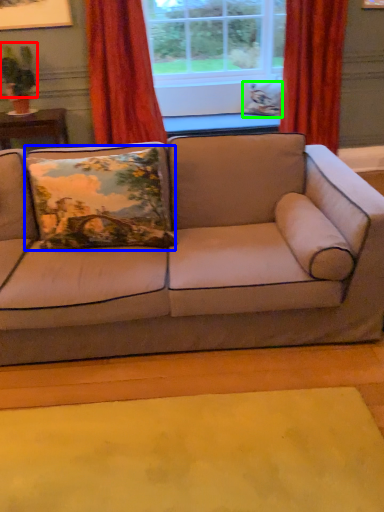
Question: Which is nearer to the plant (highlighted by a red box)? pillow (highlighted by a blue box) or pillow (highlighted by a green box).

Choices:
 (A) pillow
 (B) pillow

Answer: (A)